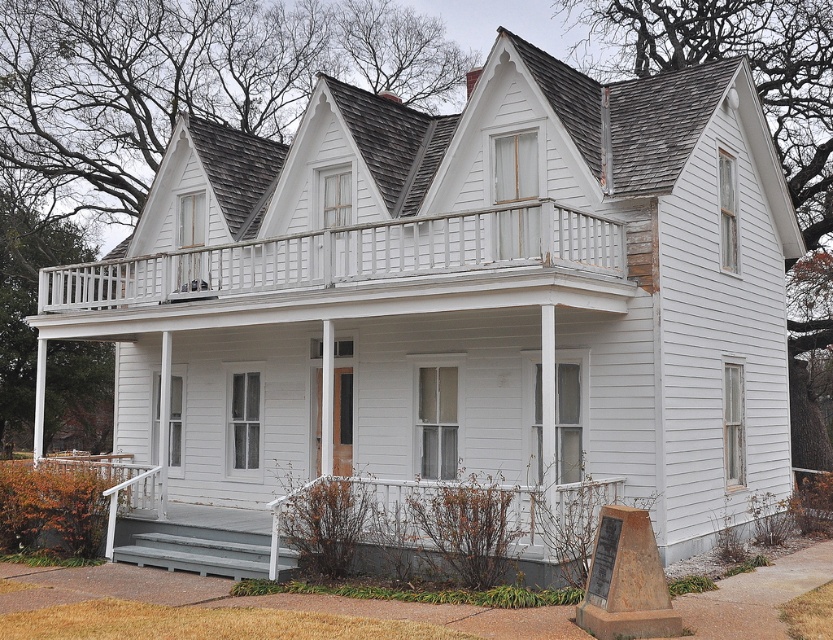
Question: Where is white wooden porch at upper center located in relation to brown stone marker at lower right in the image?

Choices:
 (A) left
 (B) right

Answer: (A)

Question: Which object appears farthest from the camera in this image?

Choices:
 (A) brown stone marker at lower right
 (B) white wooden porch at upper center

Answer: (B)

Question: Does white wooden porch at upper center appear over brown stone marker at lower right?

Choices:
 (A) no
 (B) yes

Answer: (B)

Question: Which point appears farthest from the camera in this image?

Choices:
 (A) (599, 563)
 (B) (335, 253)

Answer: (B)

Question: Does white wooden porch at upper center lie behind brown stone marker at lower right?

Choices:
 (A) yes
 (B) no

Answer: (A)

Question: Among these objects, which one is farthest from the camera?

Choices:
 (A) brown stone marker at lower right
 (B) white wooden porch at upper center

Answer: (B)